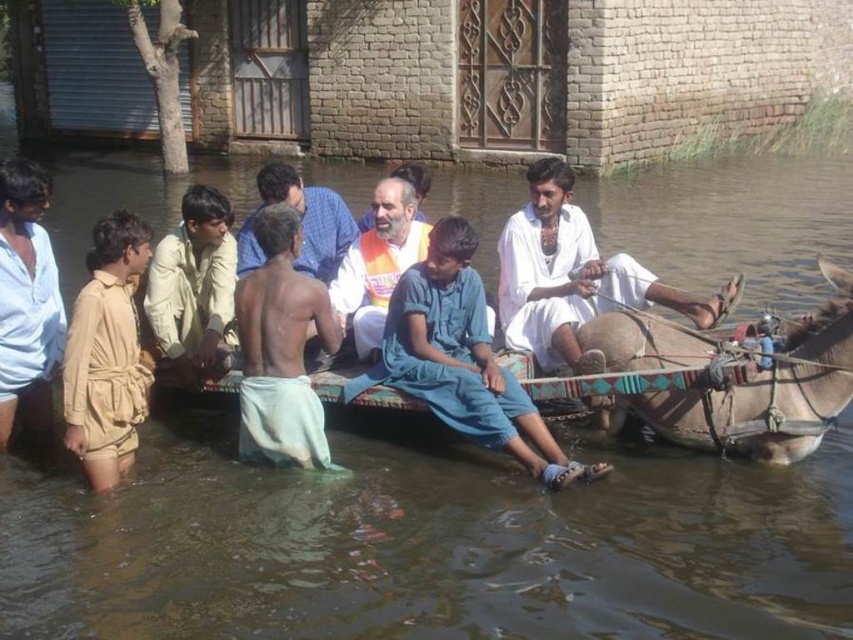
Does light beige cotton shirt at center have a greater height compared to orange fabric shirt at center?

Yes, light beige cotton shirt at center is taller than orange fabric shirt at center.

Is light beige cotton shirt at center to the right of orange fabric shirt at center from the viewer's perspective?

Incorrect, light beige cotton shirt at center is not on the right side of orange fabric shirt at center.

What do you see at coordinates (194, 285) in the screenshot? The height and width of the screenshot is (640, 853). I see `light beige cotton shirt at center` at bounding box center [194, 285].

Locate an element on the screen. light beige cotton shirt at center is located at coordinates (194, 285).

Does light brown cotton shorts at lower left have a smaller size compared to light beige cotton shirt at center?

Yes.

Which is behind, point (9, 202) or point (184, 364)?

The point (184, 364) is more distant.

Is point (48, 420) in front of point (206, 256)?

No, it is behind (206, 256).

This screenshot has width=853, height=640. Identify the location of light brown cotton shorts at lower left. (26, 300).

Measure the distance between brown rough hide mule at right and light beige cotton shirt at center.

9.40 meters

Does brown rough hide mule at right have a lesser width compared to light beige cotton shirt at center?

Yes.

Describe the element at coordinates (769, 392) in the screenshot. I see `brown rough hide mule at right` at that location.

Find the location of a particular element. brown rough hide mule at right is located at coordinates (769, 392).